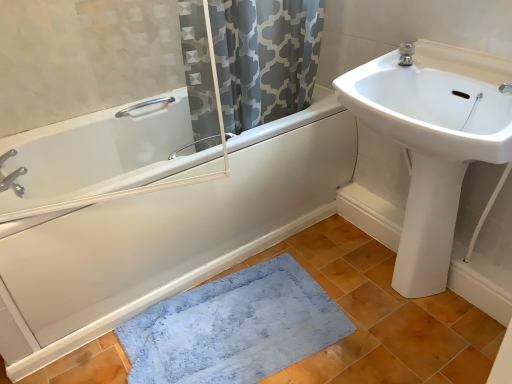
Question: Should I look upward or downward to see white glossy bidet at right?

Choices:
 (A) down
 (B) up

Answer: (A)

Question: From a real-world perspective, is white glossy bathtub at left beneath gray printed fabric at upper center?

Choices:
 (A) yes
 (B) no

Answer: (A)

Question: Considering the relative sizes of white glossy bathtub at left and gray printed fabric at upper center in the image provided, is white glossy bathtub at left wider than gray printed fabric at upper center?

Choices:
 (A) yes
 (B) no

Answer: (A)

Question: From the image's perspective, is white glossy bathtub at left beneath gray printed fabric at upper center?

Choices:
 (A) no
 (B) yes

Answer: (B)

Question: From a real-world perspective, is white glossy bathtub at left on top of gray printed fabric at upper center?

Choices:
 (A) no
 (B) yes

Answer: (A)

Question: Can you confirm if white glossy bathtub at left is bigger than gray printed fabric at upper center?

Choices:
 (A) no
 (B) yes

Answer: (B)

Question: Would you say white glossy bathtub at left contains gray printed fabric at upper center?

Choices:
 (A) yes
 (B) no

Answer: (B)

Question: Is white glossy bathtub at left next to white glossy sink at upper right?

Choices:
 (A) yes
 (B) no

Answer: (B)

Question: Does white glossy bathtub at left have a smaller size compared to white glossy sink at upper right?

Choices:
 (A) no
 (B) yes

Answer: (A)

Question: Does white glossy bathtub at left have a greater height compared to white glossy sink at upper right?

Choices:
 (A) yes
 (B) no

Answer: (A)

Question: Does white glossy bathtub at left come behind white glossy sink at upper right?

Choices:
 (A) yes
 (B) no

Answer: (A)

Question: From a real-world perspective, is white glossy bathtub at left physically below white glossy sink at upper right?

Choices:
 (A) no
 (B) yes

Answer: (B)

Question: Is white glossy sink at upper right inside white glossy bathtub at left?

Choices:
 (A) no
 (B) yes

Answer: (A)

Question: Is blue plush bath mat at lower center facing away from white glossy bathtub at left?

Choices:
 (A) no
 (B) yes

Answer: (A)